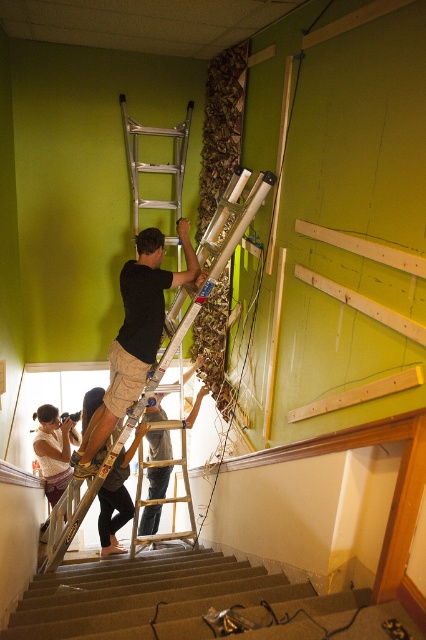
Question: Can you confirm if white lace dress at lower left is thinner than black fabric pants at lower center?

Choices:
 (A) yes
 (B) no

Answer: (A)

Question: Which point is farther from the camera taking this photo?

Choices:
 (A) (253, 192)
 (B) (184, 500)
 (C) (85, 468)

Answer: (B)

Question: Which of these objects is positioned farthest from the silver metallic ladder at center?

Choices:
 (A) wooden ladder at center
 (B) black cotton shirt at upper center
 (C) white lace dress at lower left

Answer: (C)

Question: Among these objects, which one is farthest from the camera?

Choices:
 (A) white lace dress at lower left
 (B) carpeted stairs at lower left

Answer: (A)

Question: From the image, what is the correct spatial relationship of carpeted stairs at lower left in relation to black cotton shirt at upper center?

Choices:
 (A) above
 (B) below

Answer: (B)

Question: Can you confirm if carpeted stairs at lower left is positioned to the left of white lace dress at lower left?

Choices:
 (A) no
 (B) yes

Answer: (A)